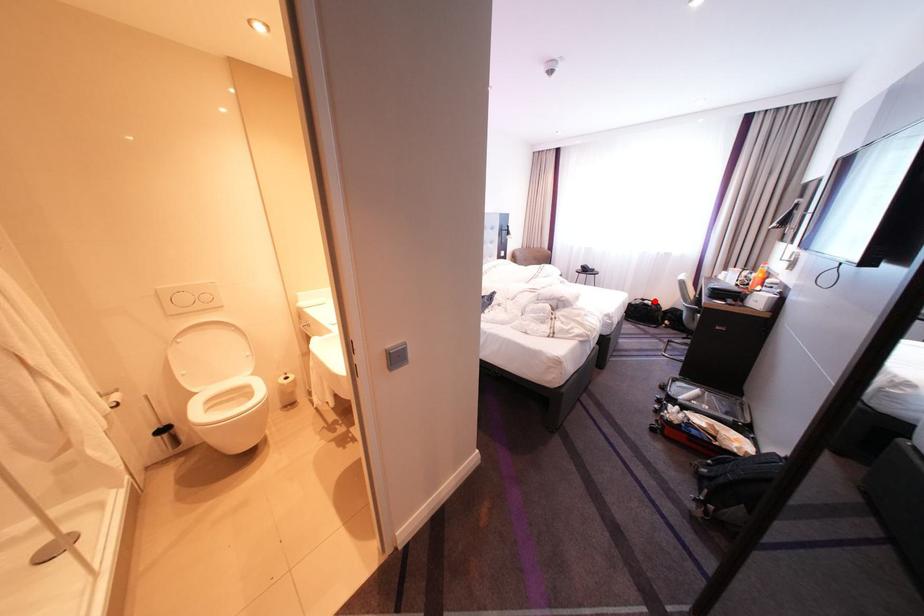
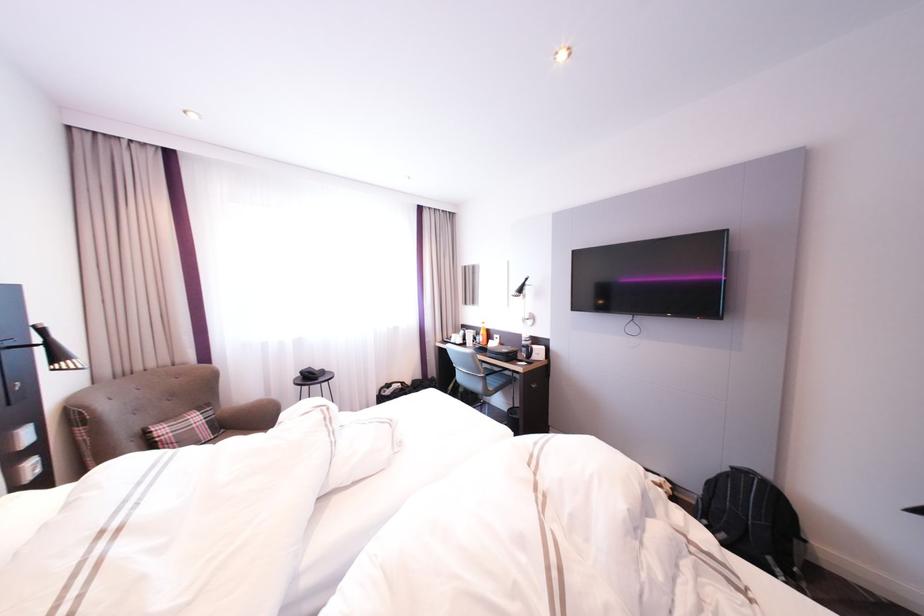
Question: I am providing you with two images of the same scene from different viewpoints. A red point is marked on the first image. Is the red point's position out of view in image 2?

Choices:
 (A) Yes
 (B) No

Answer: (B)